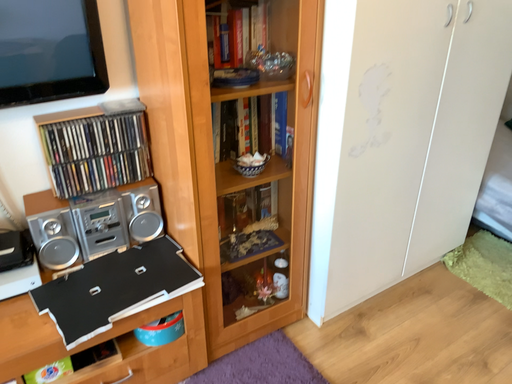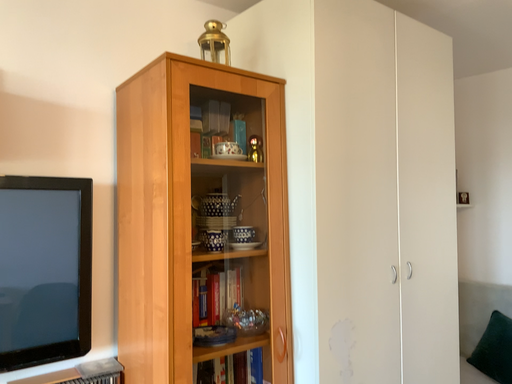
Question: How did the camera likely rotate when shooting the video?

Choices:
 (A) rotated downward
 (B) rotated upward

Answer: (B)